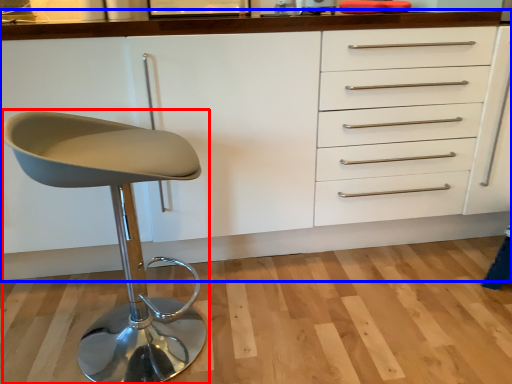
Question: Which object is closer to the camera taking this photo, chair (highlighted by a red box) or cabinetry (highlighted by a blue box)?

Choices:
 (A) chair
 (B) cabinetry

Answer: (A)